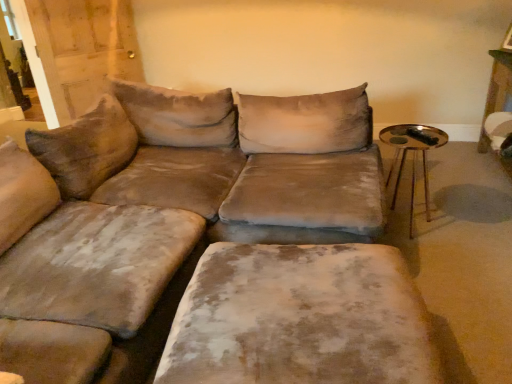
Question: Is velvet beige couch at center not within gold metallic side table at right?

Choices:
 (A) yes
 (B) no

Answer: (A)

Question: Does velvet beige couch at center have a larger size compared to gold metallic side table at right?

Choices:
 (A) no
 (B) yes

Answer: (B)

Question: Is velvet beige couch at center in front of gold metallic side table at right?

Choices:
 (A) yes
 (B) no

Answer: (A)

Question: Could you tell me if velvet beige couch at center is facing gold metallic side table at right?

Choices:
 (A) yes
 (B) no

Answer: (A)

Question: Can you confirm if velvet beige couch at center is taller than gold metallic side table at right?

Choices:
 (A) yes
 (B) no

Answer: (A)

Question: Does velvet beige couch at center have a lesser height compared to gold metallic side table at right?

Choices:
 (A) yes
 (B) no

Answer: (B)

Question: Is gold metallic side table at right further to the viewer compared to velvet beige couch at center?

Choices:
 (A) no
 (B) yes

Answer: (B)

Question: Is gold metallic side table at right outside velvet beige couch at center?

Choices:
 (A) no
 (B) yes

Answer: (B)

Question: Can you confirm if gold metallic side table at right is taller than velvet beige couch at center?

Choices:
 (A) yes
 (B) no

Answer: (B)

Question: From a real-world perspective, is gold metallic side table at right below velvet beige couch at center?

Choices:
 (A) no
 (B) yes

Answer: (B)

Question: From a real-world perspective, does gold metallic side table at right stand above velvet beige couch at center?

Choices:
 (A) yes
 (B) no

Answer: (B)

Question: Does gold metallic side table at right have a lesser width compared to velvet beige couch at center?

Choices:
 (A) yes
 (B) no

Answer: (A)

Question: Is velvet beige couch at center not inside velvet beige ottoman at center?

Choices:
 (A) no
 (B) yes

Answer: (B)